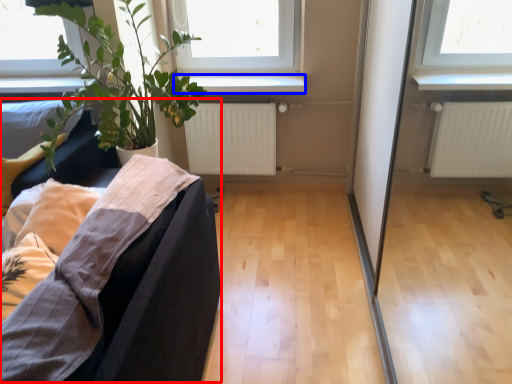
Question: Which object appears farthest to the camera in this image, couch (highlighted by a red box) or window sill (highlighted by a blue box)?

Choices:
 (A) couch
 (B) window sill

Answer: (B)